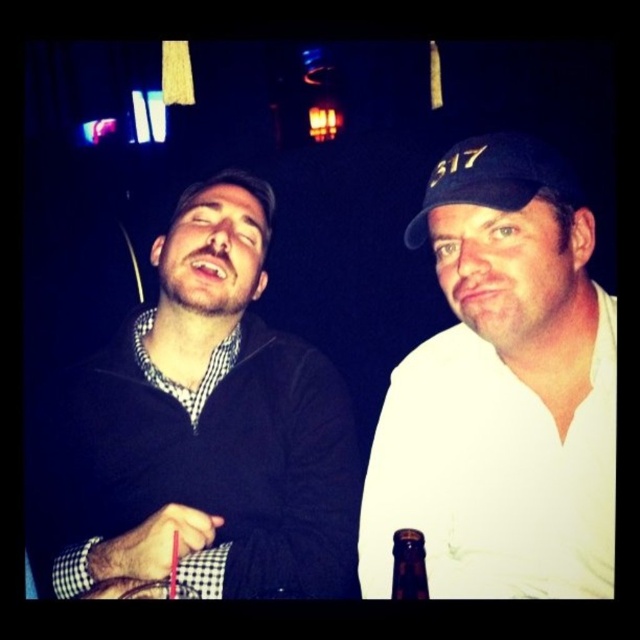
In the scene described, there are two objects of interest. The black matte sweater at center and the white matte cap at upper right. From the perspective of someone standing in front of them, which object is positioned to the left?

The black matte sweater at center is positioned to the left of the white matte cap at upper right.

Based on the scene description, where is the black matte sweater at center located in terms of coordinates?

The black matte sweater at center is located at coordinates (202, 432).

You are a photographer trying to capture a closeup shot of the black matte sweater at center and the white matte cap at upper right. The camera you have can only focus on objects within a 12 inch range. Will both items be in focus?

The black matte sweater at center is 13.46 inches away from the white matte cap at upper right. Since the camera can only focus within a 12 inch range, the distance between them exceeds the focus range. Therefore, both items cannot be in focus simultaneously.